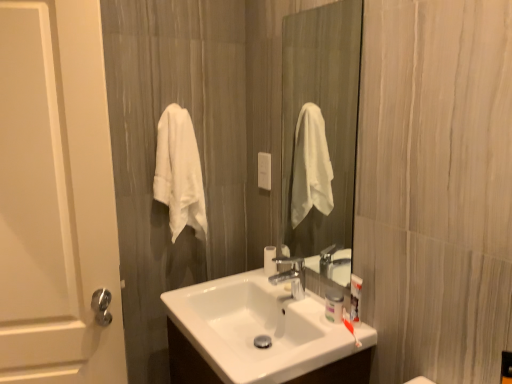
Question: Is the depth of white matte door at left greater than that of white glossy sink at center?

Choices:
 (A) no
 (B) yes

Answer: (B)

Question: Can you confirm if white matte door at left is shorter than white glossy sink at center?

Choices:
 (A) no
 (B) yes

Answer: (A)

Question: Does white matte door at left appear on the right side of white glossy sink at center?

Choices:
 (A) no
 (B) yes

Answer: (A)

Question: Is white matte door at left facing towards white glossy sink at center?

Choices:
 (A) no
 (B) yes

Answer: (A)

Question: From the image's perspective, would you say white matte door at left is shown under white glossy sink at center?

Choices:
 (A) yes
 (B) no

Answer: (B)

Question: Is white matte door at left thinner than white glossy sink at center?

Choices:
 (A) no
 (B) yes

Answer: (B)

Question: Considering the relative sizes of white soft towel at left and white glossy sink at center in the image provided, is white soft towel at left shorter than white glossy sink at center?

Choices:
 (A) yes
 (B) no

Answer: (B)

Question: Is white soft towel at left at the right side of white glossy sink at center?

Choices:
 (A) no
 (B) yes

Answer: (A)

Question: From a real-world perspective, is white soft towel at left located beneath white glossy sink at center?

Choices:
 (A) no
 (B) yes

Answer: (A)

Question: Is white soft towel at left outside of white glossy sink at center?

Choices:
 (A) no
 (B) yes

Answer: (B)

Question: Can you confirm if white soft towel at left is taller than white glossy sink at center?

Choices:
 (A) no
 (B) yes

Answer: (B)

Question: From the image's perspective, is white soft towel at left located above white glossy sink at center?

Choices:
 (A) yes
 (B) no

Answer: (A)

Question: Does white soft towel at left have a smaller size compared to clear glass mirror at center?

Choices:
 (A) yes
 (B) no

Answer: (B)